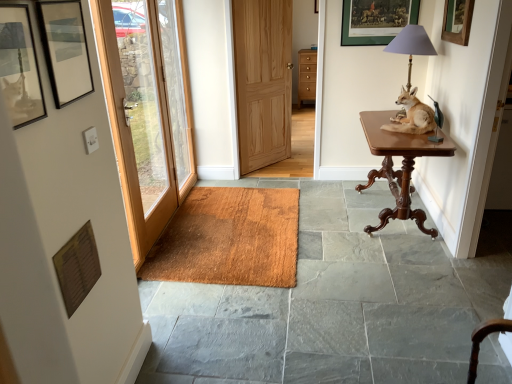
The width and height of the screenshot is (512, 384). What do you see at coordinates (263, 80) in the screenshot? I see `natural wood door at center, the second door when ordered from left to right` at bounding box center [263, 80].

In order to click on wooden picture frame at upper right, which is the 2th picture frame in back-to-front order in this screenshot , I will do `click(457, 21)`.

Describe the element at coordinates (412, 115) in the screenshot. The image size is (512, 384). I see `brown fur dog at right` at that location.

The width and height of the screenshot is (512, 384). In order to click on matte black picture frame at upper left, acting as the first picture frame starting from the bottom in this screenshot , I will do `click(19, 67)`.

Locate an element on the screen. The width and height of the screenshot is (512, 384). wooden picture frame at upper center, which is the fourth picture frame from bottom to top is located at coordinates (376, 20).

The width and height of the screenshot is (512, 384). Identify the location of natural wood door at center, placed as the first door when sorted from back to front. (263, 80).

Is wooden picture frame at upper right, the 2th picture frame viewed from the top, inside the boundaries of smooth slate floor at center, or outside?

wooden picture frame at upper right, the 2th picture frame viewed from the top, lies outside smooth slate floor at center.

Is point (462, 2) farther from viewer compared to point (234, 366)?

Yes.

This screenshot has width=512, height=384. What are the coordinates of `concrete that appears below the wooden picture frame at upper right, which is the 2th picture frame in back-to-front order (from the image's perspective)` in the screenshot? It's located at (331, 304).

Is the surface of wooden picture frame at upper right, the third picture frame viewed from the front, in direct contact with smooth slate floor at center?

No, wooden picture frame at upper right, the third picture frame viewed from the front, is not making contact with smooth slate floor at center.

Is smooth slate floor at center located outside natural wood door at center, positioned as the second door in front-to-back order?

Yes, smooth slate floor at center is not within natural wood door at center, positioned as the second door in front-to-back order.

Can you confirm if smooth slate floor at center is taller than natural wood door at center, placed as the 1th door when sorted from right to left?

No, smooth slate floor at center is not taller than natural wood door at center, placed as the 1th door when sorted from right to left.

Identify the location of door that is the 2nd object located behind the smooth slate floor at center. The image size is (512, 384). (263, 80).

Based on the photo, from the image's perspective, which one is positioned higher, smooth slate floor at center or natural wood door at center, the second door when ordered from left to right?

From the image's view, natural wood door at center, the second door when ordered from left to right, is above.

Which object is further away from the camera, wooden picture frame at upper center, which is the fourth picture frame from bottom to top, or wooden door at left, marked as the 2th door in a back-to-front arrangement?

Positioned behind is wooden picture frame at upper center, which is the fourth picture frame from bottom to top.

Looking at this image, considering the sizes of objects wooden picture frame at upper center, which is the fourth picture frame from bottom to top, and wooden door at left, which is the first door in front-to-back order, in the image provided, who is bigger, wooden picture frame at upper center, which is the fourth picture frame from bottom to top, or wooden door at left, which is the first door in front-to-back order,?

wooden door at left, which is the first door in front-to-back order, is bigger.

Does wooden picture frame at upper center, which appears as the 1th picture frame when viewed from the top, touch wooden door at left, positioned as the first door in left-to-right order?

No, wooden picture frame at upper center, which appears as the 1th picture frame when viewed from the top, is not making contact with wooden door at left, positioned as the first door in left-to-right order.

Is wooden picture frame at upper center, which appears as the 1th picture frame when viewed from the top, surrounding wooden door at left, which is counted as the 2th door, starting from the right?

No, wooden door at left, which is counted as the 2th door, starting from the right, is not a part of wooden picture frame at upper center, which appears as the 1th picture frame when viewed from the top.

From the image's perspective, is wooden door at left, which is the first door in front-to-back order, beneath matte black picture frame at upper left, acting as the first picture frame starting from the bottom?

Incorrect, from the image's perspective, wooden door at left, which is the first door in front-to-back order, is higher than matte black picture frame at upper left, acting as the first picture frame starting from the bottom.

Is the position of wooden door at left, positioned as the first door in left-to-right order, less distant than that of matte black picture frame at upper left, the 4th picture frame viewed from the right?

That is False.

From a real-world perspective, is wooden door at left, marked as the 2th door in a back-to-front arrangement, under matte black picture frame at upper left, the 4th picture frame from the back?

Yes.

Are wooden door at left, which is the first door in front-to-back order, and matte black picture frame at upper left, the 1th picture frame in the front-to-back sequence, far apart?

Absolutely, wooden door at left, which is the first door in front-to-back order, is distant from matte black picture frame at upper left, the 1th picture frame in the front-to-back sequence.

Is point (168, 207) positioned behind point (370, 142)?

That is True.

Can you confirm if wooden door at left, marked as the 2th door in a back-to-front arrangement, is wider than mahogany wood table at right?

No, wooden door at left, marked as the 2th door in a back-to-front arrangement, is not wider than mahogany wood table at right.

Considering the positions of objects wooden door at left, which is counted as the 2th door, starting from the right, and mahogany wood table at right in the image provided, who is behind, wooden door at left, which is counted as the 2th door, starting from the right, or mahogany wood table at right?

mahogany wood table at right is more distant.

Which is in front, matte glass picture frame at upper left, which is the 2th picture frame in front-to-back order, or brown textured mat at center?

matte glass picture frame at upper left, which is the 2th picture frame in front-to-back order, is more forward.

Is brown textured mat at center a part of matte glass picture frame at upper left, which is the second picture frame from bottom to top?

No, brown textured mat at center is not a part of matte glass picture frame at upper left, which is the second picture frame from bottom to top.

From the image's perspective, does matte glass picture frame at upper left, the 3th picture frame viewed from the top, appear lower than brown textured mat at center?

No, from the image's perspective, matte glass picture frame at upper left, the 3th picture frame viewed from the top, is not below brown textured mat at center.

Is brown fur dog at right not within wooden picture frame at upper center, marked as the 2th picture frame in a right-to-left arrangement?

Yes.

Which is nearer, (426, 118) or (412, 8)?

Positioned in front is point (426, 118).

Is brown fur dog at right shorter than wooden picture frame at upper center, which is counted as the first picture frame, starting from the back?

Correct, brown fur dog at right is not as tall as wooden picture frame at upper center, which is counted as the first picture frame, starting from the back.

Which object is more forward, brown fur dog at right or wooden picture frame at upper center, marked as the 2th picture frame in a right-to-left arrangement?

brown fur dog at right is in front.

From a real-world perspective, count 2nd picture frames upward from the smooth slate floor at center and point to it. Please provide its 2D coordinates.

[(457, 21)]

Locate an element on the screen. This screenshot has height=384, width=512. concrete below the natural wood door at center, positioned as the second door in front-to-back order (from a real-world perspective) is located at coordinates (331, 304).

Which object lies further to the anchor point wooden door at left, which is counted as the 2th door, starting from the right, wooden picture frame at upper right, the 3th picture frame from the bottom, or clear glass door at left?

The object further to wooden door at left, which is counted as the 2th door, starting from the right, is wooden picture frame at upper right, the 3th picture frame from the bottom.

Based on their spatial positions, is smooth slate floor at center or mahogany wood table at right closer to wooden picture frame at upper center, marked as the 2th picture frame in a right-to-left arrangement?

mahogany wood table at right is positioned closer to the anchor wooden picture frame at upper center, marked as the 2th picture frame in a right-to-left arrangement.

When comparing their distances from brown textured mat at center, does metallic gray lampshade at upper right or wooden door at left, positioned as the first door in left-to-right order, seem further?

metallic gray lampshade at upper right is positioned further to the anchor brown textured mat at center.

Which object lies nearer to the anchor point brown textured mat at center, brown fur dog at right or wooden door at left, marked as the 2th door in a back-to-front arrangement?

wooden door at left, marked as the 2th door in a back-to-front arrangement.

Looking at the image, which one is located closer to wooden door at left, positioned as the first door in left-to-right order, matte glass picture frame at upper left, which is the 2th picture frame in front-to-back order, or wooden picture frame at upper center, acting as the 3th picture frame starting from the left?

matte glass picture frame at upper left, which is the 2th picture frame in front-to-back order, is closer to wooden door at left, positioned as the first door in left-to-right order.

Based on their spatial positions, is wooden picture frame at upper center, which is counted as the first picture frame, starting from the back, or wooden door at left, positioned as the first door in left-to-right order, closer to wooden picture frame at upper right, the 3th picture frame from the bottom?

wooden picture frame at upper center, which is counted as the first picture frame, starting from the back, is positioned closer to the anchor wooden picture frame at upper right, the 3th picture frame from the bottom.

When comparing their distances from metallic gray lampshade at upper right, does brown textured mat at center or matte black picture frame at upper left, the 1th picture frame in the front-to-back sequence, seem further?

matte black picture frame at upper left, the 1th picture frame in the front-to-back sequence, is further to metallic gray lampshade at upper right.

Looking at the image, which one is located closer to wooden door at left, marked as the 2th door in a back-to-front arrangement, mahogany wood table at right or matte glass picture frame at upper left, which ranks as the third picture frame in back-to-front order?

matte glass picture frame at upper left, which ranks as the third picture frame in back-to-front order.

Identify the location of concrete between matte black picture frame at upper left, positioned as the 1th picture frame in left-to-right order, and brown fur dog at right in the front-back direction. (331, 304).

Where is `dog situated between clear glass door at left and metallic gray lampshade at upper right from left to right`? dog situated between clear glass door at left and metallic gray lampshade at upper right from left to right is located at coordinates (412, 115).

The width and height of the screenshot is (512, 384). I want to click on window between matte black picture frame at upper left, the 4th picture frame from the back, and wooden picture frame at upper center, marked as the 2th picture frame in a right-to-left arrangement, from front to back, so click(x=177, y=92).

In order to click on table lamp between wooden picture frame at upper center, marked as the 2th picture frame in a right-to-left arrangement, and mahogany wood table at right vertically in this screenshot , I will do `click(411, 45)`.